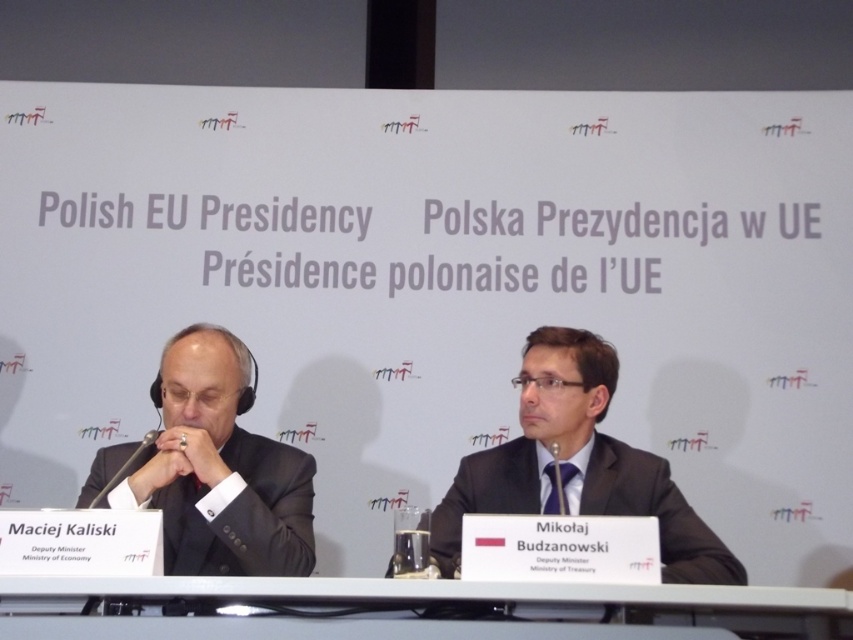
Question: Estimate the real-world distances between objects in this image. Which object is farther from the black matte suit at left?

Choices:
 (A) gray plastic table at center
 (B) matte black suit at center

Answer: (B)

Question: Among these points, which one is farthest from the camera?

Choices:
 (A) (480, 468)
 (B) (230, 387)
 (C) (630, 600)

Answer: (A)

Question: Can you confirm if black matte suit at left is positioned below matte black suit at center?

Choices:
 (A) no
 (B) yes

Answer: (A)

Question: Among these points, which one is farthest from the camera?

Choices:
 (A) (229, 596)
 (B) (585, 332)
 (C) (257, 534)

Answer: (B)

Question: Can you confirm if matte black suit at center is positioned below gray plastic table at center?

Choices:
 (A) no
 (B) yes

Answer: (A)

Question: Is matte black suit at center closer to the viewer compared to gray plastic table at center?

Choices:
 (A) no
 (B) yes

Answer: (A)